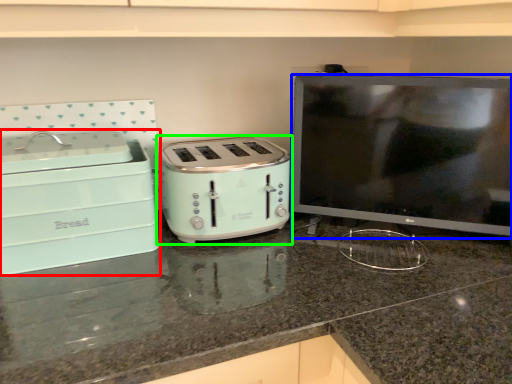
Question: Which is nearer to the home appliance (highlighted by a red box)? appliance (highlighted by a blue box) or toaster (highlighted by a green box).

Choices:
 (A) appliance
 (B) toaster

Answer: (B)